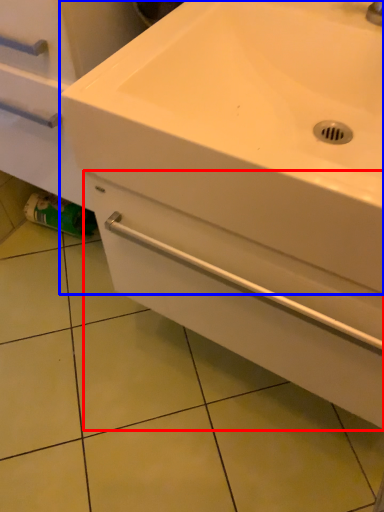
Question: Which point is closer to the camera, drawer (highlighted by a red box) or sink (highlighted by a blue box)?

Choices:
 (A) drawer
 (B) sink

Answer: (B)